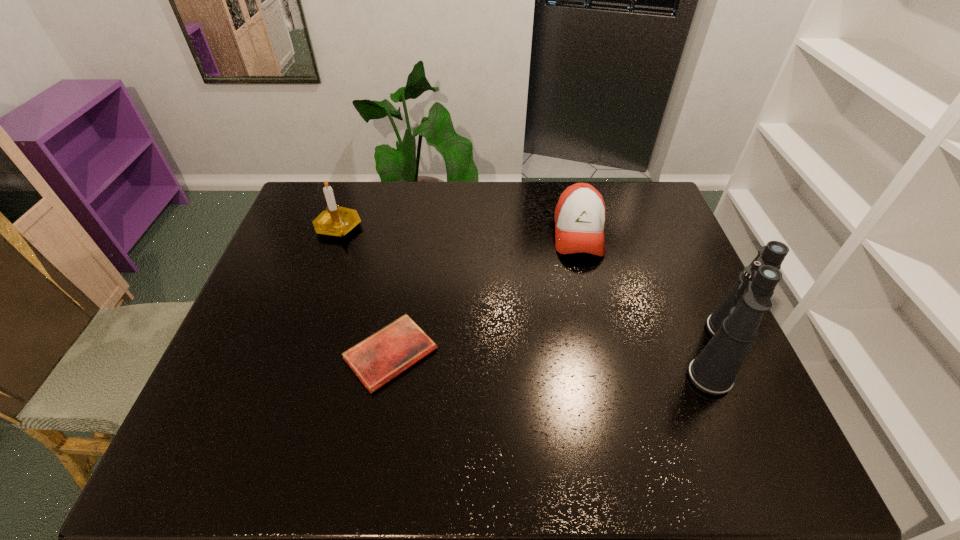
Identify the location of object located at the left edge. This screenshot has height=540, width=960. (336, 221).

You are a GUI agent. You are given a task and a screenshot of the screen. Output one action in this format:
    pyautogui.click(x=<x>, y=<y>)
    Task: Click on the object that is at the right edge
    
    Given the screenshot: What is the action you would take?
    pyautogui.click(x=733, y=326)

This screenshot has height=540, width=960. Find the location of `object that is positioned at the far left corner`. object that is positioned at the far left corner is located at coordinates (336, 221).

Find the location of a particular element. This screenshot has height=540, width=960. object located at the near right corner is located at coordinates (733, 326).

In the image, there is a desktop. Where is `vacant space at the far edge`? vacant space at the far edge is located at coordinates (532, 182).

In the image, there is a desktop. At what (x,y) coordinates should I click in order to perform the action: click on vacant space at the near edge. Please return your answer as a coordinate pair (x, y). Looking at the image, I should click on (607, 399).

The width and height of the screenshot is (960, 540). In order to click on vacant space at the left edge in this screenshot , I will do click(309, 238).

Locate an element on the screen. The height and width of the screenshot is (540, 960). blank area at the far right corner is located at coordinates (657, 198).

This screenshot has height=540, width=960. Find the location of `vacant space at the near right corner`. vacant space at the near right corner is located at coordinates (747, 418).

You are a GUI agent. You are given a task and a screenshot of the screen. Output one action in this format:
    pyautogui.click(x=<x>, y=<y>)
    Task: Click on the free spot between the third object from right to left and the candle holder
    
    Given the screenshot: What is the action you would take?
    pyautogui.click(x=364, y=291)